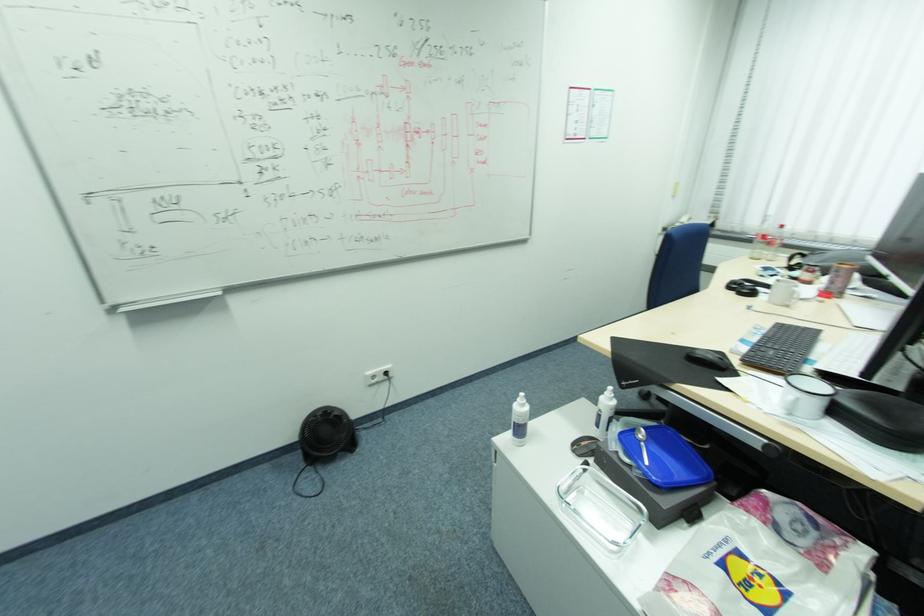
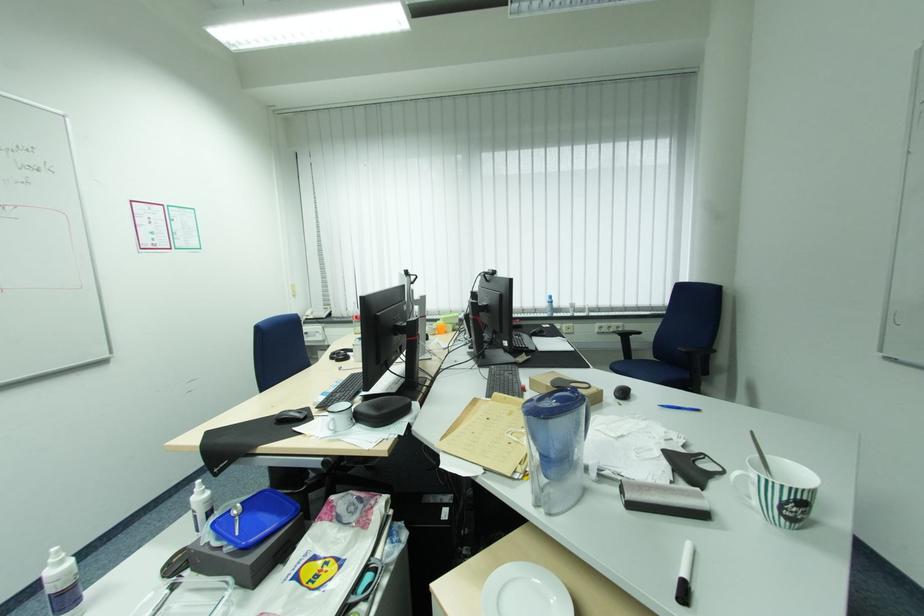
Where in the second image is the point corresponding to [804,399] from the first image?

(339, 419)